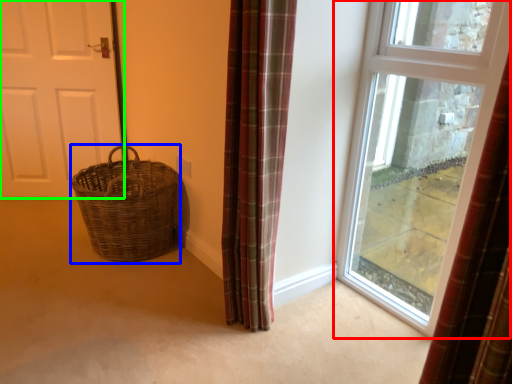
Question: Based on their relative distances, which object is farther from window (highlighted by a red box)? Choose from basket (highlighted by a blue box) and door (highlighted by a green box).

Choices:
 (A) basket
 (B) door

Answer: (B)